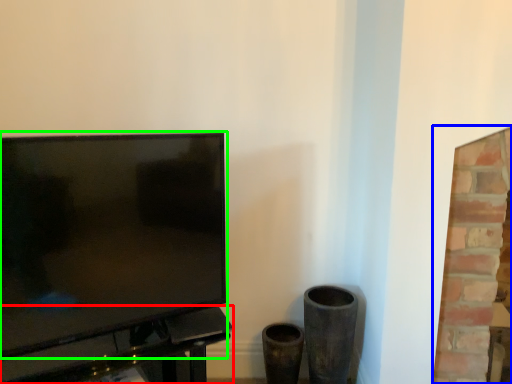
Question: Based on their relative distances, which object is farther from table (highlighted by a red box)? Choose from fireplace (highlighted by a blue box) and television (highlighted by a green box).

Choices:
 (A) fireplace
 (B) television

Answer: (A)